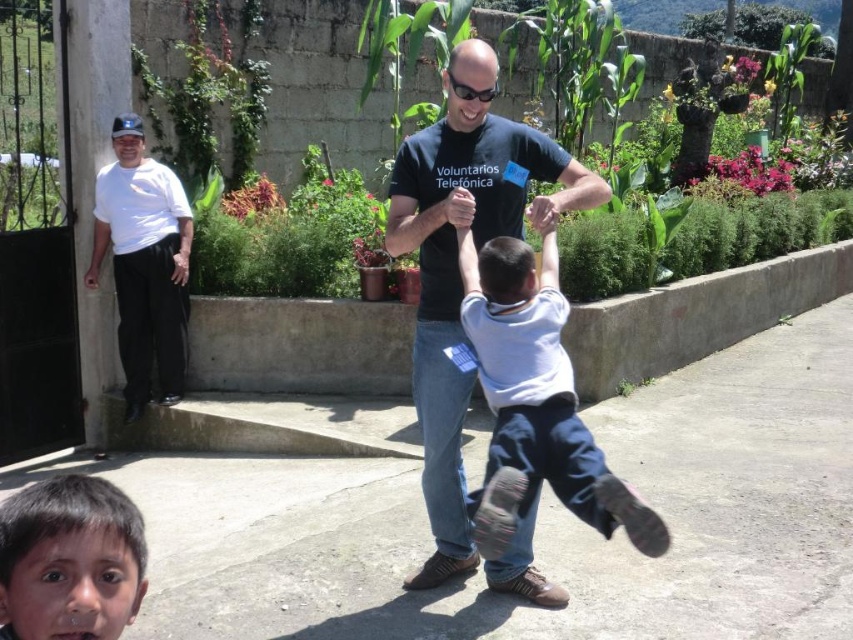
Question: Does gray concrete pavement at center appear on the right side of black plastic sunglasses at center?

Choices:
 (A) yes
 (B) no

Answer: (A)

Question: Is black cotton t-shirt at center below dark brown hair at lower left?

Choices:
 (A) no
 (B) yes

Answer: (A)

Question: Does black cotton t-shirt at center appear on the right side of black plastic sunglasses at center?

Choices:
 (A) no
 (B) yes

Answer: (B)

Question: Which point is closer to the camera taking this photo?

Choices:
 (A) 97,198
 (B) 492,262
 (C) 85,500

Answer: (C)

Question: Among these points, which one is farthest from the camera?

Choices:
 (A) (685, 448)
 (B) (479, 355)

Answer: (A)

Question: Estimate the real-world distances between objects in this image. Which object is farther from the white cotton shirt at upper left?

Choices:
 (A) dark brown hair at lower left
 (B) black cotton t-shirt at center
 (C) gray concrete pavement at center
 (D) white cotton shirt at center

Answer: (A)